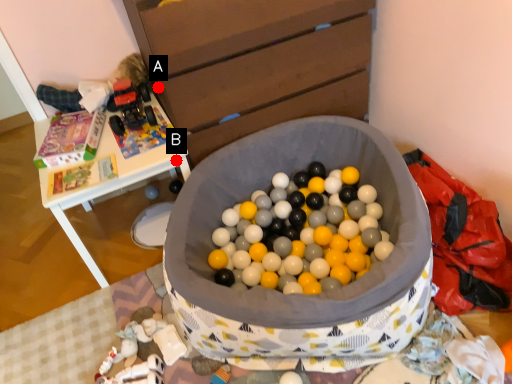
Question: Two points are circled on the image, labeled by A and B beside each circle. Which point appears farthest from the camera in this image?

Choices:
 (A) A is further
 (B) B is further

Answer: (B)